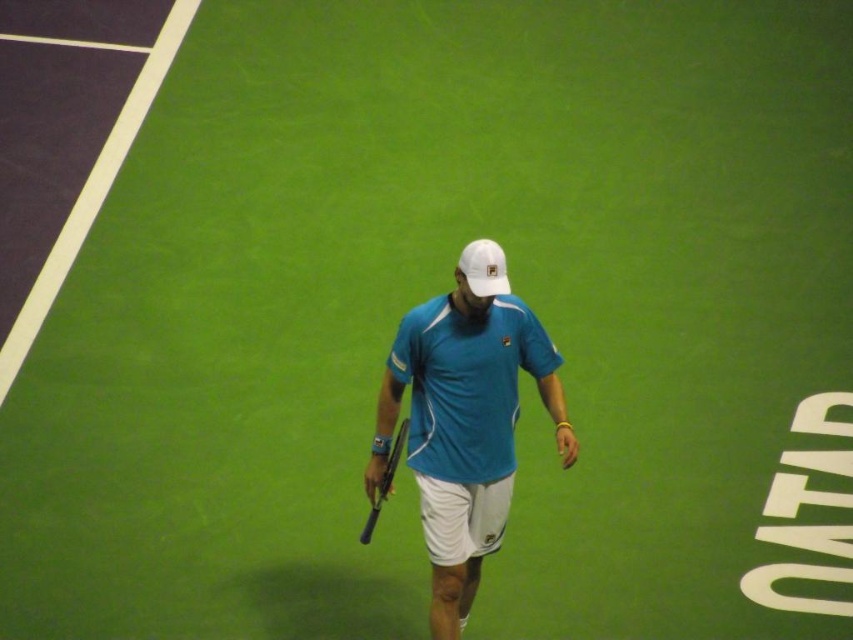
You are a tennis coach observing a player holding two tennis rackets, a black matte tennis racket at center and a black rubber tennis racket at center. Which racket is taller?

The black matte tennis racket at center is taller than the black rubber tennis racket at center.

You are a tennis ball that just bounced on the court. You want to roll towards the net, which is located at the lower end of the court. There are two points marked on the court at coordinates point (x=402, y=444) and point (x=378, y=464). Which point is closer to the net?

Point (x=402, y=444) is further to the camera than point (x=378, y=464). Since the net is at the lower end of the court, the point closer to the net would be the one closer to the camera. Therefore, point (x=378, y=464) is closer to the net.

You are a tennis instructor observing a player on the court. You notice the blue fabric shirt at center and the black matte tennis racket at center. Which object is positioned higher in the image?

The blue fabric shirt at center is above the black matte tennis racket at center, so the blue fabric shirt at center is positioned higher in the image.